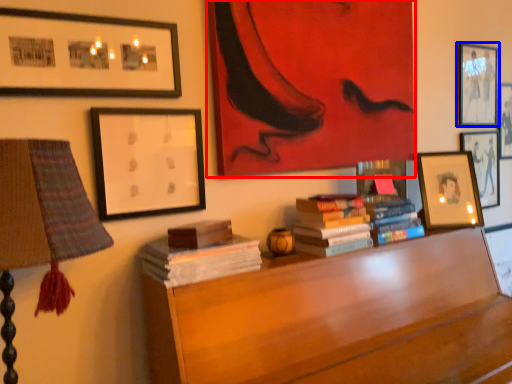
Question: Which point is closer to the camera, picture frame (highlighted by a red box) or picture frame (highlighted by a blue box)?

Choices:
 (A) picture frame
 (B) picture frame

Answer: (A)